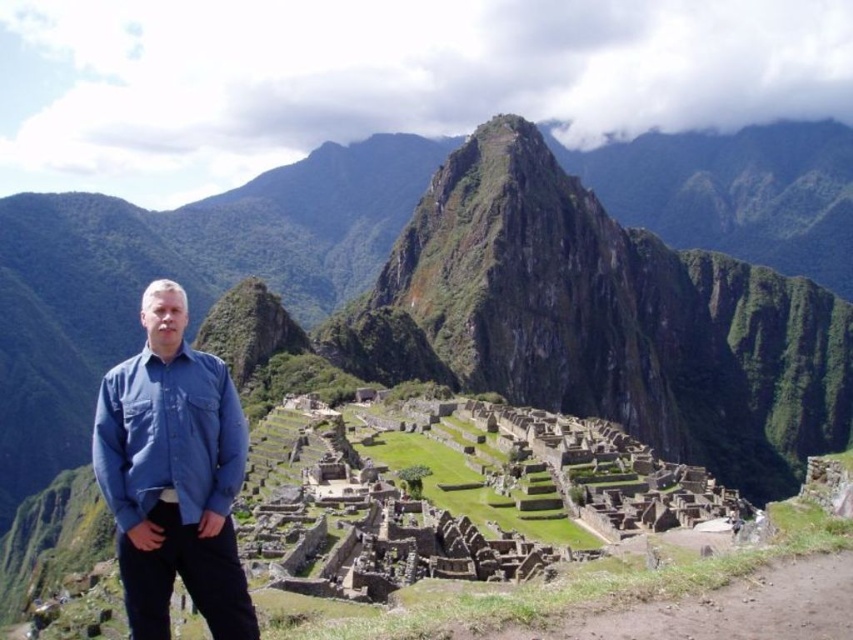
You are standing at the point closer to the camera between the two points, point 1 at (12,506) and point 2 at (222,522). Which point are you at?

You are at point 1 at (12,506) because it is closer to the camera than point 2 at (222,522).

You are a photographer at Machu Picchu and want to capture a photo where the blue cotton shirt at left is in the foreground while keeping the green grassy mountain at center visible in the background. Is this possible?

The green grassy mountain at center is positioned over the blue cotton shirt at left, so yes, the photographer can capture the blue cotton shirt at left in the foreground while the green grassy mountain at center remains visible in the background.

Based on the scene description, where is the green grassy mountain at center located in the image?

The green grassy mountain at center is located at point (175, 275).